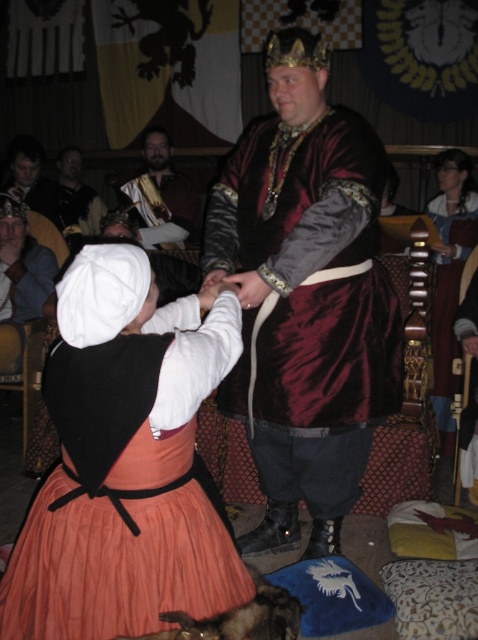
Between orange pleated fabric dress at lower left and gold textured fabric at center, which one has more height?

With more height is gold textured fabric at center.

Does orange pleated fabric dress at lower left appear over gold textured fabric at center?

No.

Between point (119, 484) and point (141, 198), which one is positioned behind?

The point (141, 198) is behind.

The height and width of the screenshot is (640, 478). I want to click on orange pleated fabric dress at lower left, so click(x=117, y=564).

Who is lower down, velvet burgundy vest at center or dark brown leather jacket at upper center?

velvet burgundy vest at center is below.

Can you confirm if velvet burgundy vest at center is taller than dark brown leather jacket at upper center?

Yes.

Locate an element on the screen. This screenshot has height=640, width=478. velvet burgundy vest at center is located at coordinates (305, 298).

In order to click on velvet burgundy vest at center in this screenshot , I will do `click(305, 298)`.

Can you confirm if orange pleated fabric dress at lower left is wider than dark brown leather jacket at upper center?

Correct, the width of orange pleated fabric dress at lower left exceeds that of dark brown leather jacket at upper center.

The height and width of the screenshot is (640, 478). I want to click on orange pleated fabric dress at lower left, so click(117, 564).

Which is in front, point (26, 625) or point (85, 214)?

Point (26, 625)

Image resolution: width=478 pixels, height=640 pixels. Identify the location of orange pleated fabric dress at lower left. (117, 564).